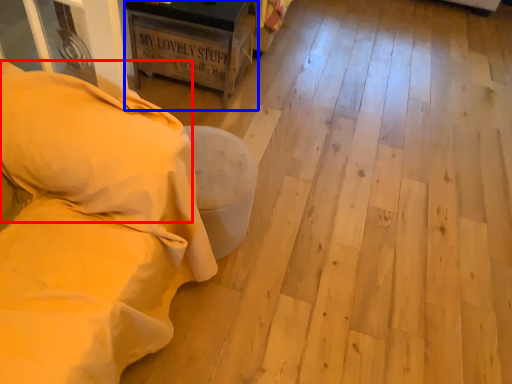
Question: Which object is further to the camera taking this photo, pillow (highlighted by a red box) or furniture (highlighted by a blue box)?

Choices:
 (A) pillow
 (B) furniture

Answer: (B)